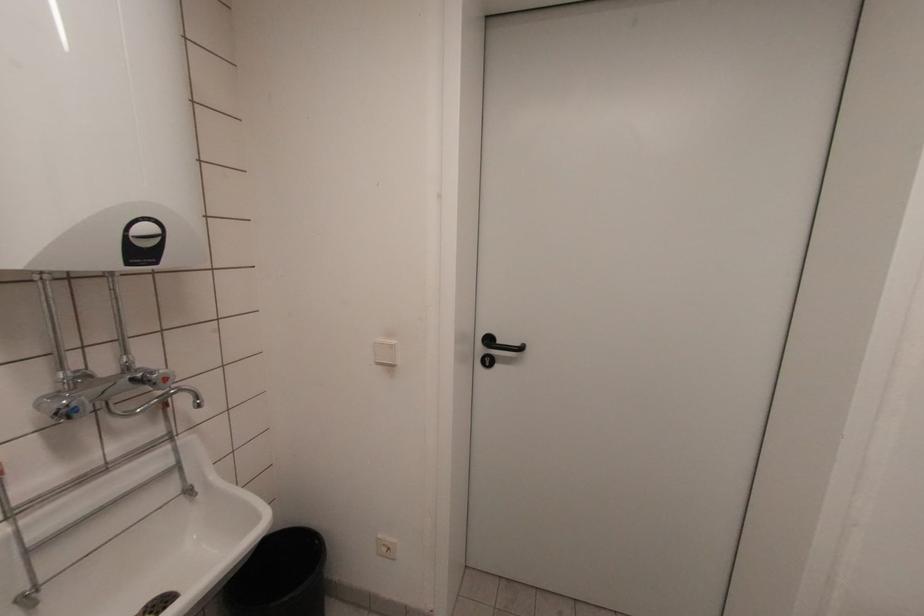
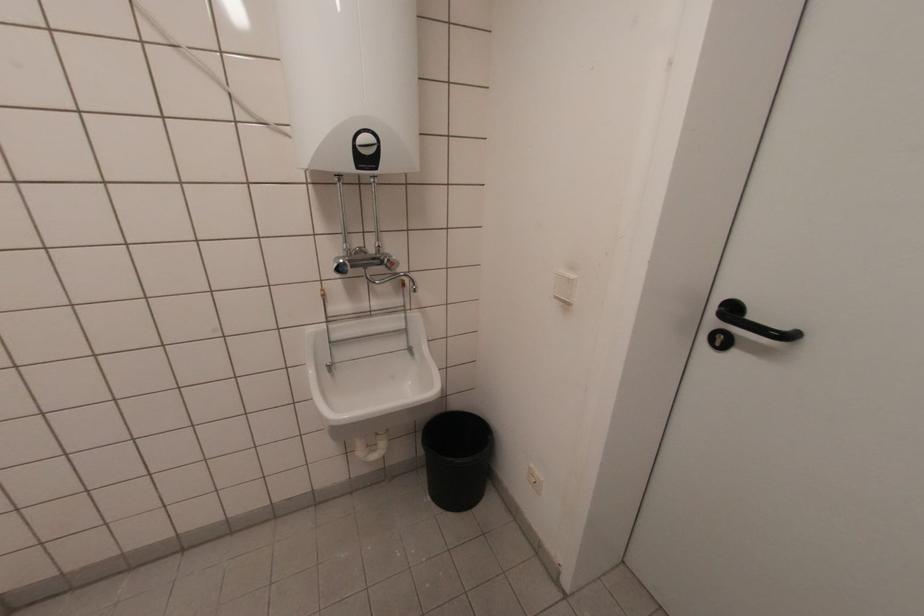
Locate, in the second image, the point that corresponds to (488,363) in the first image.

(719, 344)